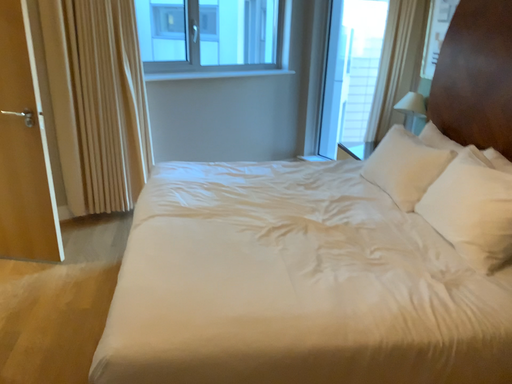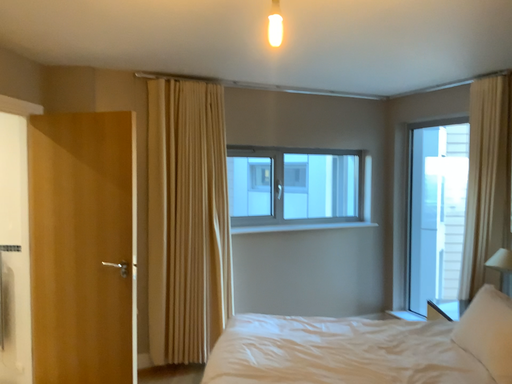
Question: Which way did the camera rotate in the video?

Choices:
 (A) rotated left
 (B) rotated right

Answer: (A)